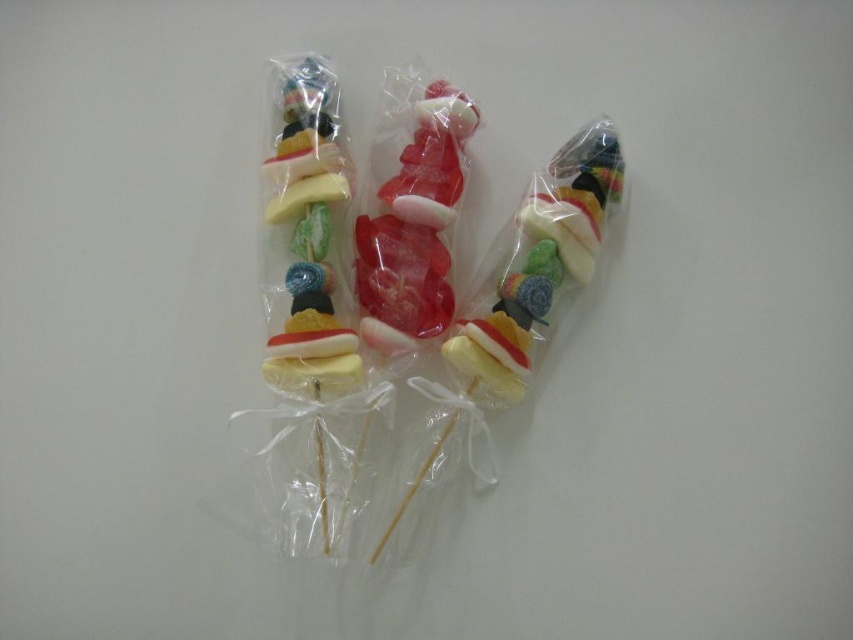
Question: Which point appears closest to the camera in this image?

Choices:
 (A) (387, 132)
 (B) (552, 282)

Answer: (B)

Question: Which object appears farthest from the camera in this image?

Choices:
 (A) translucent plastic candy at center
 (B) translucent rubber candy at center
 (C) translucent plastic lollipops at center

Answer: (A)

Question: Considering the real-world distances, which object is farthest from the translucent plastic lollipops at center?

Choices:
 (A) translucent rubber candy at center
 (B) translucent plastic candy at center

Answer: (A)

Question: Is translucent plastic candy at center positioned before translucent rubber candy at center?

Choices:
 (A) yes
 (B) no

Answer: (B)

Question: Can you confirm if translucent plastic lollipops at center is wider than translucent rubber candy at center?

Choices:
 (A) yes
 (B) no

Answer: (A)

Question: Is translucent plastic lollipops at center above translucent plastic candy at center?

Choices:
 (A) yes
 (B) no

Answer: (B)